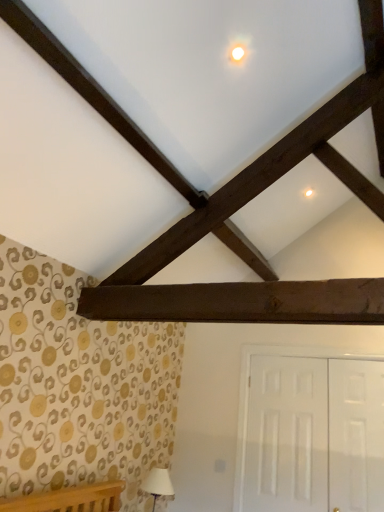
This screenshot has height=512, width=384. What do you see at coordinates (240, 302) in the screenshot?
I see `dark brown wood plank at center` at bounding box center [240, 302].

Locate an element on the screen. Image resolution: width=384 pixels, height=512 pixels. white glossy door at right, the 1th door in the right-to-left sequence is located at coordinates (356, 435).

Identify the location of white fabric lampshade at lower left. The width and height of the screenshot is (384, 512). (158, 484).

You are a GUI agent. You are given a task and a screenshot of the screen. Output one action in this format:
    pyautogui.click(x=<x>, y=<y>)
    Task: Click on the dark brown wood plank at center
    This screenshot has width=384, height=512.
    Given the screenshot: What is the action you would take?
    pyautogui.click(x=240, y=302)

Which point is more forward, (286, 373) or (152, 489)?

Positioned in front is point (152, 489).

Is white glossy door at lower right, the 1th door when ordered from left to right, positioned with its back to white fabric lampshade at lower left?

No, white glossy door at lower right, the 1th door when ordered from left to right, is not facing away from white fabric lampshade at lower left.

From a real-world perspective, which object stands above the other?

From a 3D spatial view, white glossy door at lower right, which appears as the second door when viewed from the right, is above.

Image resolution: width=384 pixels, height=512 pixels. I want to click on plank positioned vertically above the white fabric lampshade at lower left (from a real-world perspective), so coord(240,302).

Considering the positions of objects dark brown wood plank at center and white fabric lampshade at lower left in the image provided, who is in front, dark brown wood plank at center or white fabric lampshade at lower left?

Positioned in front is dark brown wood plank at center.

Is point (168, 320) positioned behind point (165, 493)?

No, it is in front of (165, 493).

From a real-world perspective, is white fabric lampshade at lower left on dark brown wood plank at center?

No, from a real-world perspective, white fabric lampshade at lower left is not over dark brown wood plank at center

Considering the sizes of objects white fabric lampshade at lower left and dark brown wood plank at center in the image provided, who is shorter, white fabric lampshade at lower left or dark brown wood plank at center?

With less height is dark brown wood plank at center.

Is dark brown wood plank at center a part of white fabric lampshade at lower left?

No, white fabric lampshade at lower left does not contain dark brown wood plank at center.

Is white fabric lampshade at lower left oriented towards dark brown wood plank at center?

No, white fabric lampshade at lower left is not facing towards dark brown wood plank at center.

Is white fabric lampshade at lower left facing away from white glossy door at right, the second door when ordered from left to right?

white fabric lampshade at lower left is not turned away from white glossy door at right, the second door when ordered from left to right.

From a real-world perspective, does white fabric lampshade at lower left stand above white glossy door at right, the 1th door in the right-to-left sequence?

No, from a real-world perspective, white fabric lampshade at lower left is not above white glossy door at right, the 1th door in the right-to-left sequence.

How many degrees apart are the facing directions of white fabric lampshade at lower left and white glossy door at right, the second door when ordered from left to right?

The facing directions of white fabric lampshade at lower left and white glossy door at right, the second door when ordered from left to right, are 92.2 degrees apart.

Is dark brown wood plank at center with white glossy door at lower right, the 1th door when ordered from left to right?

They are not placed beside each other.

Which is correct: dark brown wood plank at center is inside white glossy door at lower right, the 1th door when ordered from left to right, or outside of it?

The correct answer is: outside.

Can you confirm if dark brown wood plank at center is taller than white glossy door at lower right, the 1th door when ordered from left to right?

No.

Is point (265, 301) closer or farther from the camera than point (252, 452)?

Point (265, 301).

Does white glossy door at lower right, which appears as the second door when viewed from the right, have a greater width compared to dark brown wood plank at center?

In fact, white glossy door at lower right, which appears as the second door when viewed from the right, might be narrower than dark brown wood plank at center.

Which is more to the right, white glossy door at lower right, which appears as the second door when viewed from the right, or dark brown wood plank at center?

From the viewer's perspective, white glossy door at lower right, which appears as the second door when viewed from the right, appears more on the right side.

Is white glossy door at lower right, the 1th door when ordered from left to right, oriented towards dark brown wood plank at center?

Yes.

Based on their positions, is white glossy door at lower right, the 1th door when ordered from left to right, located to the left or right of white glossy door at right, the second door when ordered from left to right?

white glossy door at lower right, the 1th door when ordered from left to right, is positioned on white glossy door at right, the second door when ordered from left to right,'s left side.

Who is bigger, white glossy door at lower right, which appears as the second door when viewed from the right, or white glossy door at right, the 1th door in the right-to-left sequence?

white glossy door at lower right, which appears as the second door when viewed from the right, is bigger.

Is there a large distance between white glossy door at lower right, the 1th door when ordered from left to right, and white glossy door at right, the second door when ordered from left to right?

No, white glossy door at lower right, the 1th door when ordered from left to right, is not far from white glossy door at right, the second door when ordered from left to right.

How many degrees apart are the facing directions of white glossy door at lower right, which appears as the second door when viewed from the right, and white glossy door at right, the second door when ordered from left to right?

They differ by 1.17 degrees in their facing directions.

This screenshot has height=512, width=384. In order to click on table lamp below the white glossy door at lower right, the 1th door when ordered from left to right (from the image's perspective) in this screenshot , I will do `click(158, 484)`.

Find the location of a particular element. The width and height of the screenshot is (384, 512). table lamp to the left of dark brown wood plank at center is located at coordinates (158, 484).

Based on their spatial positions, is white glossy door at lower right, the 1th door when ordered from left to right, or white glossy door at right, the second door when ordered from left to right, further from white fabric lampshade at lower left?

Based on the image, white glossy door at right, the second door when ordered from left to right, appears to be further to white fabric lampshade at lower left.

Estimate the real-world distances between objects in this image. Which object is closer to white fabric lampshade at lower left, dark brown wood plank at center or white glossy door at right, the second door when ordered from left to right?

Based on the image, white glossy door at right, the second door when ordered from left to right, appears to be nearer to white fabric lampshade at lower left.

Estimate the real-world distances between objects in this image. Which object is further from dark brown wood plank at center, white glossy door at lower right, the 1th door when ordered from left to right, or white fabric lampshade at lower left?

Among the two, white fabric lampshade at lower left is located further to dark brown wood plank at center.

When comparing their distances from white fabric lampshade at lower left, does dark brown wood plank at center or white glossy door at lower right, which appears as the second door when viewed from the right, seem further?

The object further to white fabric lampshade at lower left is dark brown wood plank at center.

Looking at this image, looking at the image, which one is located closer to dark brown wood plank at center, white fabric lampshade at lower left or white glossy door at lower right, the 1th door when ordered from left to right?

white glossy door at lower right, the 1th door when ordered from left to right, is positioned closer to the anchor dark brown wood plank at center.

From the image, which object appears to be farther from white glossy door at lower right, the 1th door when ordered from left to right, dark brown wood plank at center or white glossy door at right, the 1th door in the right-to-left sequence?

The object further to white glossy door at lower right, the 1th door when ordered from left to right, is dark brown wood plank at center.

From the image, which object appears to be farther from white glossy door at lower right, the 1th door when ordered from left to right, white glossy door at right, the second door when ordered from left to right, or white fabric lampshade at lower left?

white fabric lampshade at lower left lies further to white glossy door at lower right, the 1th door when ordered from left to right, than the other object.

Estimate the real-world distances between objects in this image. Which object is further from white glossy door at lower right, the 1th door when ordered from left to right, white fabric lampshade at lower left or white glossy door at right, the second door when ordered from left to right?

white fabric lampshade at lower left is further to white glossy door at lower right, the 1th door when ordered from left to right.

Image resolution: width=384 pixels, height=512 pixels. What are the coordinates of `plank located between white fabric lampshade at lower left and white glossy door at right, the 1th door in the right-to-left sequence, in the left-right direction` in the screenshot? It's located at (240, 302).

Identify the location of door between white fabric lampshade at lower left and white glossy door at right, the 1th door in the right-to-left sequence, in the horizontal direction. The width and height of the screenshot is (384, 512). coord(309,433).

You are a GUI agent. You are given a task and a screenshot of the screen. Output one action in this format:
    pyautogui.click(x=<x>, y=<y>)
    Task: Click on the door that lies between dark brown wood plank at center and white glossy door at lower right, the 1th door when ordered from left to right, from top to bottom
    
    Given the screenshot: What is the action you would take?
    pyautogui.click(x=356, y=435)